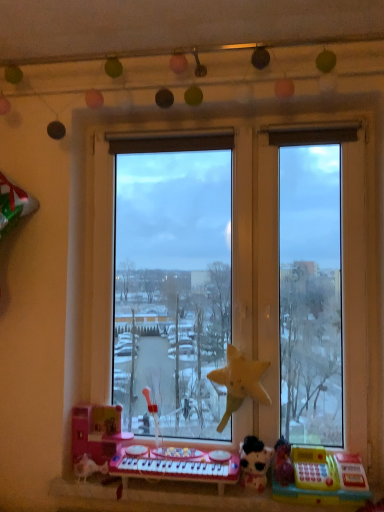
Question: Is plastic toy keyboard at lower center inside the boundaries of yellow matte star at center, the 2th toy when ordered from left to right, or outside?

Choices:
 (A) inside
 (B) outside

Answer: (B)

Question: Relative to yellow matte star at center, the 3th toy positioned from the right, is plastic toy keyboard at lower center in front or behind?

Choices:
 (A) behind
 (B) front

Answer: (B)

Question: Which is nearer to the plastic toy keyboard at lower center?

Choices:
 (A) pink plastic toy at lower left, the fourth toy when ordered from right to left
 (B) pink plastic musical keyboard at lower center
 (C) transparent glass window at center
 (D) white plush cat at lower right, which is the 2th toy from right to left
 (E) yellow matte star at center, the 3th toy positioned from the right

Answer: (B)

Question: Estimate the real-world distances between objects in this image. Which object is closer to the pink plastic musical keyboard at lower center?

Choices:
 (A) transparent glass window at center
 (B) white plush cat at lower right, which is the 2th toy from right to left
 (C) yellow matte star at center, the 2th toy when ordered from left to right
 (D) pink plastic toy at lower left, the fourth toy when ordered from right to left
 (E) plastic toy keyboard at lower center

Answer: (E)